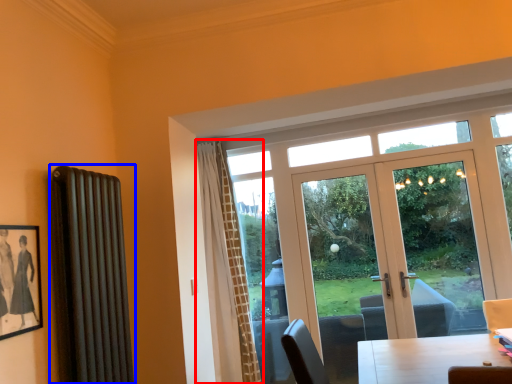
Question: Which point is further to the camera, curtain (highlighted by a red box) or radiator (highlighted by a blue box)?

Choices:
 (A) curtain
 (B) radiator

Answer: (A)